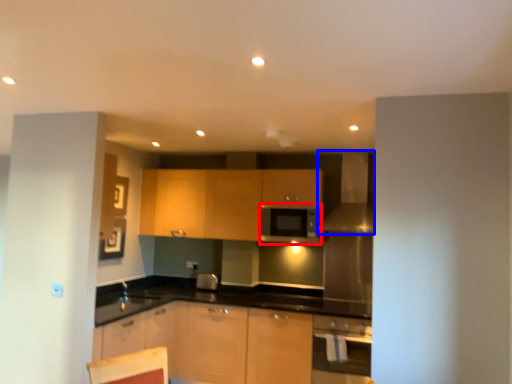
Question: Which of the following is the farthest to the observer, appliance (highlighted by a red box) or exhaust hood (highlighted by a blue box)?

Choices:
 (A) appliance
 (B) exhaust hood

Answer: (A)